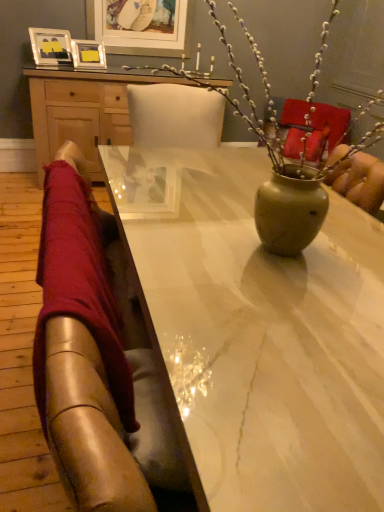
Question: Does denim jeans at left have a smaller size compared to white marble table at center?

Choices:
 (A) no
 (B) yes

Answer: (B)

Question: Is white marble table at center located within denim jeans at left?

Choices:
 (A) yes
 (B) no

Answer: (B)

Question: From the image's perspective, is denim jeans at left above white marble table at center?

Choices:
 (A) no
 (B) yes

Answer: (B)

Question: Is denim jeans at left shorter than white marble table at center?

Choices:
 (A) no
 (B) yes

Answer: (B)

Question: Is denim jeans at left closer to the viewer compared to white marble table at center?

Choices:
 (A) yes
 (B) no

Answer: (B)

Question: Is denim jeans at left directly adjacent to white marble table at center?

Choices:
 (A) yes
 (B) no

Answer: (B)

Question: From a real-world perspective, is matte green vase at center positioned under matte white picture frame at upper center, the 1th picture frame when ordered from right to left, based on gravity?

Choices:
 (A) no
 (B) yes

Answer: (B)

Question: Is matte green vase at center to the right of matte white picture frame at upper center, the 1th picture frame when ordered from right to left, from the viewer's perspective?

Choices:
 (A) yes
 (B) no

Answer: (A)

Question: From a real-world perspective, is matte green vase at center over matte white picture frame at upper center, marked as the 3th picture frame in a left-to-right arrangement?

Choices:
 (A) no
 (B) yes

Answer: (A)

Question: From the image's perspective, would you say matte green vase at center is shown under matte white picture frame at upper center, marked as the 3th picture frame in a left-to-right arrangement?

Choices:
 (A) no
 (B) yes

Answer: (B)

Question: Would you say matte green vase at center is a long distance from matte white picture frame at upper center, marked as the 3th picture frame in a left-to-right arrangement?

Choices:
 (A) no
 (B) yes

Answer: (B)

Question: Is matte green vase at center beside matte white picture frame at upper center, marked as the 3th picture frame in a left-to-right arrangement?

Choices:
 (A) yes
 (B) no

Answer: (B)

Question: Are matte green vase at center and wooden desk at upper center located far from each other?

Choices:
 (A) yes
 (B) no

Answer: (A)